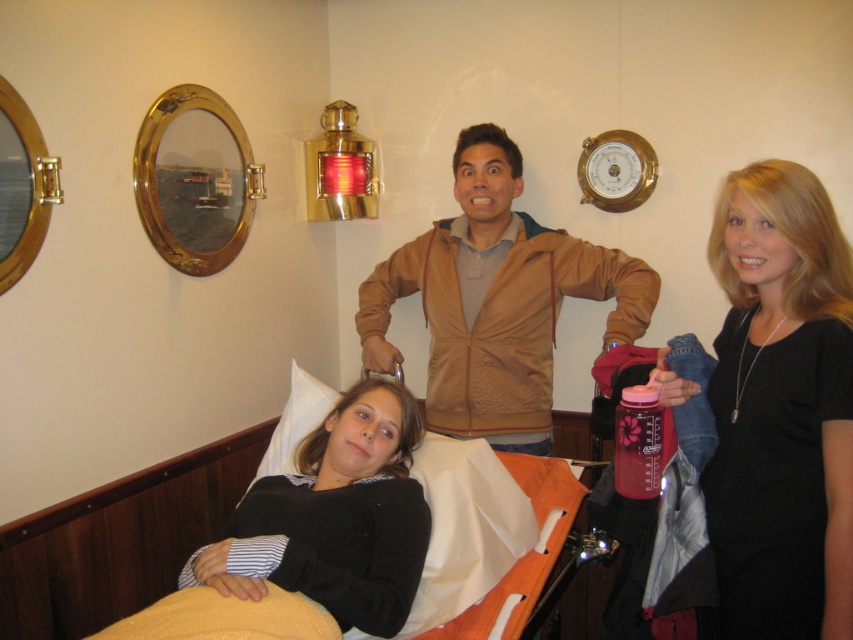
You are a nurse checking on a patient in a room with maritime decor. You see the black matte sweater at center and the white soft pillow at lower center. Which object is closer to the floor?

The black matte sweater at center is located below the white soft pillow at lower center, so it is closer to the floor.

You are a nurse checking on a patient in a maritime themed room. The patient is wearing the black matte sweater at center and lying on a cot with the white soft pillow at lower center. From your perspective, which item is closer to you?

The black matte sweater at center is closer to you because it is in front of the white soft pillow at lower center.

You are a nurse checking the bed space for a patient. The stretcher has limited space. The black matte sweater at center and white soft pillow at lower center are both on the stretcher. Which item takes up more horizontal space?

The black matte sweater at center takes up more horizontal space than the white soft pillow at lower center because its width surpasses the pillow.